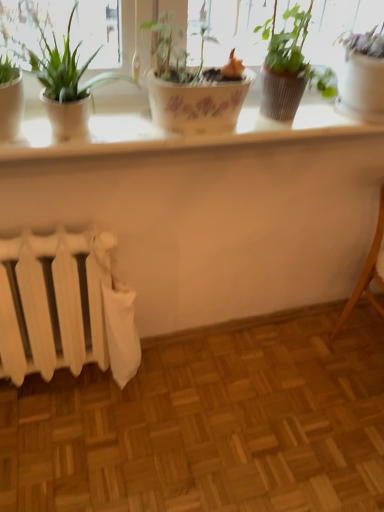
This screenshot has height=512, width=384. What are the coordinates of `vacant space underneath green matte plant at left, placed as the 3th houseplant when sorted from right to left (from a real-world perspective)` in the screenshot? It's located at (91, 131).